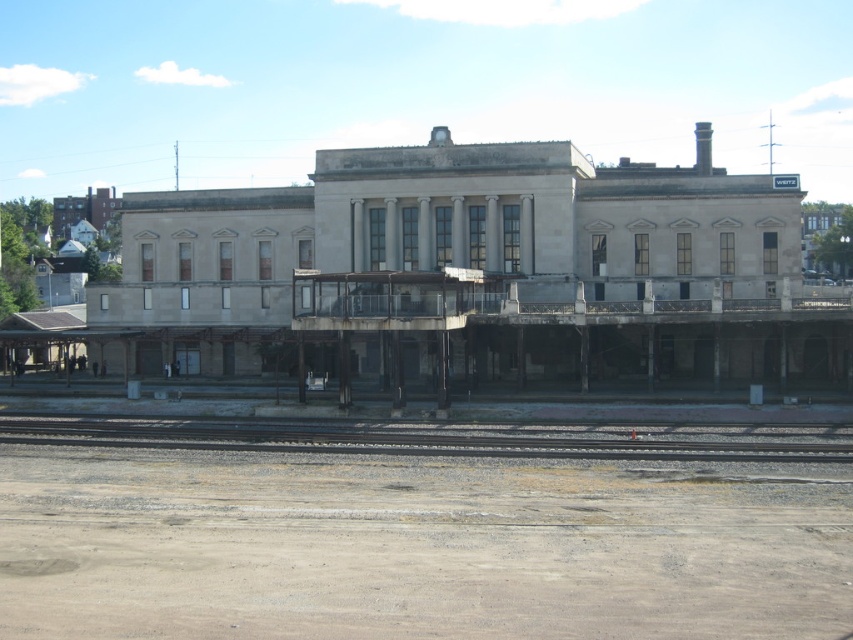
From the picture: You are a passenger standing on the gray gravel train track at lower center and want to board the train. The entrance to the gray concrete railway station at center is at the same level as the track. Do you need to climb up or go down to enter the station?

The gray concrete railway station at center is taller than gray gravel train track at lower center, so you need to climb up to enter the station.

You are a train conductor preparing to dock at the gray concrete railway station at center. You notice the gray gravel train track at lower center. Will the station be wide enough to accommodate the train?

The gray concrete railway station at center might be wider than gray gravel train track at lower center, so it is possible that the station is wide enough to accommodate the train.